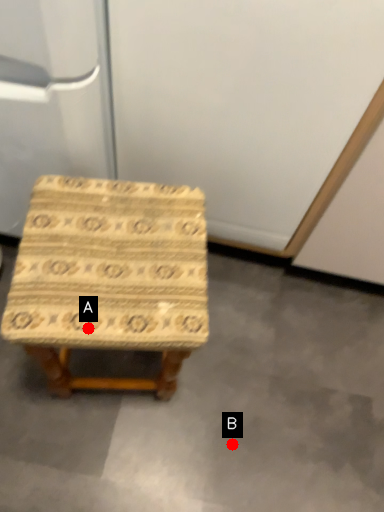
Question: Two points are circled on the image, labeled by A and B beside each circle. Which point is closer to the camera?

Choices:
 (A) A is closer
 (B) B is closer

Answer: (A)